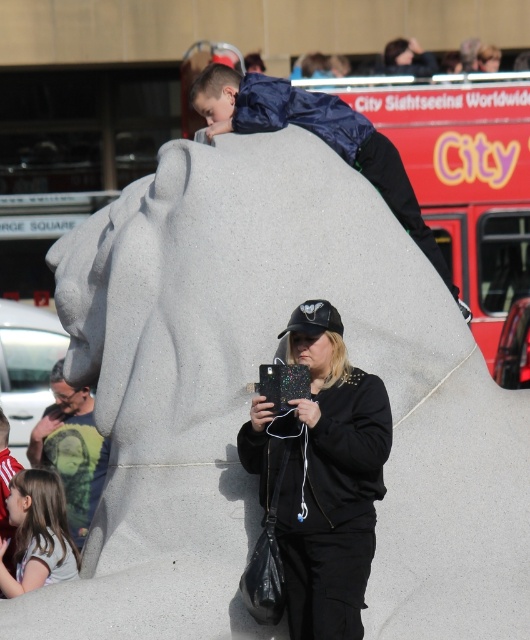
Question: Is green t-shirt at left behind light brown hair at lower left?

Choices:
 (A) no
 (B) yes

Answer: (B)

Question: Which object is the farthest from the green t-shirt at left?

Choices:
 (A) matte blue jacket at upper center
 (B) light brown hair at lower left

Answer: (A)

Question: Which point appears farthest from the camera in this image?

Choices:
 (A) (208, 74)
 (B) (364, 374)
 (C) (76, 531)

Answer: (C)

Question: Estimate the real-world distances between objects in this image. Which object is farther from the matte blue jacket at upper center?

Choices:
 (A) light brown hair at lower left
 (B) black matte jacket at center
 (C) green t-shirt at left

Answer: (C)

Question: Can you confirm if black matte jacket at center is thinner than matte blue jacket at upper center?

Choices:
 (A) no
 (B) yes

Answer: (B)

Question: Observing the image, what is the correct spatial positioning of black matte jacket at center in reference to green t-shirt at left?

Choices:
 (A) above
 (B) below

Answer: (A)